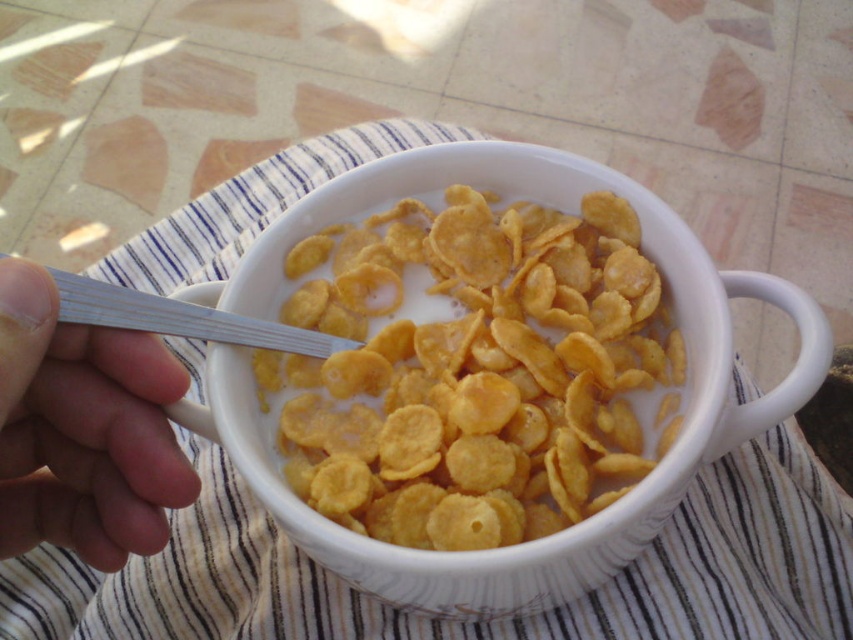
What are the coordinates of `white plastic spoon at upper left` in the screenshot? It's located at (83, 429).

Does white plastic spoon at upper left appear on the right side of white plastic spoon at center?

No, white plastic spoon at upper left is not to the right of white plastic spoon at center.

Where is `white plastic spoon at upper left`? The width and height of the screenshot is (853, 640). white plastic spoon at upper left is located at coordinates (83, 429).

Based on the photo, measure the distance from yellow matte cornflakes at center to white plastic spoon at upper left.

yellow matte cornflakes at center and white plastic spoon at upper left are 5.66 inches apart from each other.

Does point (538, 250) come closer to viewer compared to point (165, 451)?

No.

In the scene shown: Who is more distant from viewer, (619, 435) or (26, 348)?

The point (619, 435) is more distant.

This screenshot has height=640, width=853. Identify the location of yellow matte cornflakes at center. (476, 371).

Measure the distance from yellow matte cornflakes at center to white plastic spoon at center.

yellow matte cornflakes at center and white plastic spoon at center are 3.55 inches apart.

Find the location of a particular element. yellow matte cornflakes at center is located at coordinates (476, 371).